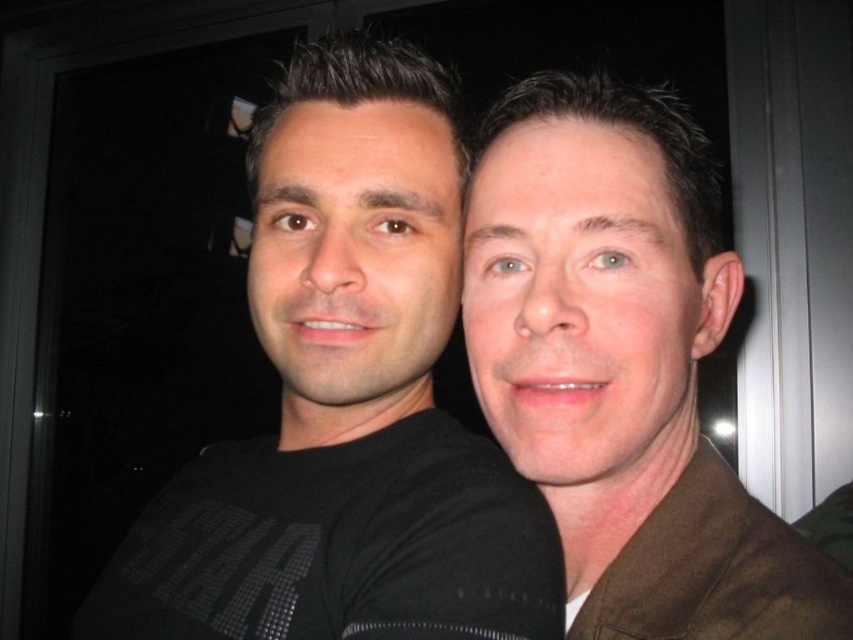
You are a photographer trying to adjust the lighting for a photo shoot. You notice the black matte shirt at left and the brown matte jacket at right. Which clothing item might require more light to ensure it doesn absorbs too much light and appears too dark in the photo?

The black matte shirt at left requires more light because it has a larger size compared to the brown matte jacket at right, meaning it will absorb more light and appear darker if not properly illuminated.

You are a photographer trying to adjust the lighting for a photo shoot. You notice the black matte shirt at left and the brown matte jacket at right. Which object is located to the left of the other?

The black matte shirt at left is positioned on the left side of brown matte jacket at right.

Looking at this image, you are a photographer trying to decide where to place a third person in the frame. The black matte shirt at left and brown matte jacket at right are already positioned. Which side has more space for the new person?

The black matte shirt at left might be wider than brown matte jacket at right, so there is more space on the left side for the new person.